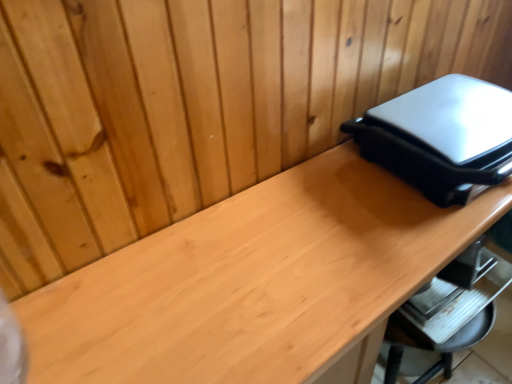
Question: Does matte wood desk at right have a greater height compared to satin black appliance at upper right?

Choices:
 (A) yes
 (B) no

Answer: (A)

Question: Is matte wood desk at right positioned before satin black appliance at upper right?

Choices:
 (A) yes
 (B) no

Answer: (A)

Question: Does matte wood desk at right have a lesser width compared to satin black appliance at upper right?

Choices:
 (A) yes
 (B) no

Answer: (B)

Question: Considering the relative sizes of matte wood desk at right and satin black appliance at upper right in the image provided, is matte wood desk at right shorter than satin black appliance at upper right?

Choices:
 (A) yes
 (B) no

Answer: (B)

Question: Is matte wood desk at right behind satin black appliance at upper right?

Choices:
 (A) no
 (B) yes

Answer: (A)

Question: Is matte wood desk at right outside of satin black appliance at upper right?

Choices:
 (A) yes
 (B) no

Answer: (A)

Question: Would you say matte wood desk at right is part of satin black appliance at upper right's contents?

Choices:
 (A) no
 (B) yes

Answer: (A)

Question: Does satin black appliance at upper right have a smaller size compared to matte wood desk at right?

Choices:
 (A) yes
 (B) no

Answer: (A)

Question: From a real-world perspective, does satin black appliance at upper right sit lower than matte wood desk at right?

Choices:
 (A) no
 (B) yes

Answer: (A)

Question: Is satin black appliance at upper right not near matte wood desk at right?

Choices:
 (A) no
 (B) yes

Answer: (A)

Question: Considering the relative positions of satin black appliance at upper right and matte wood desk at right in the image provided, is satin black appliance at upper right to the left of matte wood desk at right from the viewer's perspective?

Choices:
 (A) no
 (B) yes

Answer: (A)

Question: Does satin black appliance at upper right turn towards matte wood desk at right?

Choices:
 (A) yes
 (B) no

Answer: (B)

Question: In the image, is satin black appliance at upper right on the left side or the right side of matte wood desk at right?

Choices:
 (A) right
 (B) left

Answer: (A)